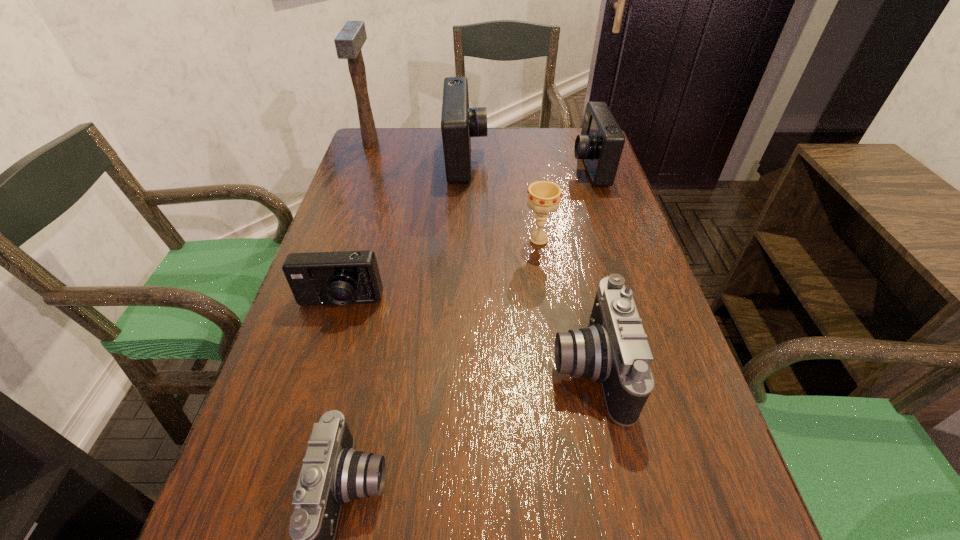
You are a GUI agent. You are given a task and a screenshot of the screen. Output one action in this format:
    pyautogui.click(x=<x>, y=<y>)
    Task: Click on the mallet situated at the far edge
    
    Given the screenshot: What is the action you would take?
    [x=351, y=38]

At what (x,y) coordinates should I click in order to perform the action: click on mallet that is at the left edge. Please return your answer as a coordinate pair (x, y). This screenshot has height=540, width=960. Looking at the image, I should click on (351, 38).

You are a GUI agent. You are given a task and a screenshot of the screen. Output one action in this format:
    pyautogui.click(x=<x>, y=<y>)
    Task: Click on the camera at the left edge
    The height and width of the screenshot is (540, 960).
    Given the screenshot: What is the action you would take?
    pyautogui.click(x=343, y=277)

Where is `object that is at the far left corner`? The width and height of the screenshot is (960, 540). object that is at the far left corner is located at coordinates (351, 38).

I want to click on object located at the far right corner, so 600,145.

What are the coordinates of `vacant space at the far edge` in the screenshot? It's located at coord(541,156).

Locate an element on the screen. This screenshot has width=960, height=540. vacant area at the left edge is located at coordinates (349, 186).

At what (x,y) coordinates should I click in order to perform the action: click on vacant position at the right edge of the desktop. Please return your answer as a coordinate pair (x, y). Looking at the image, I should click on (682, 496).

Find the location of a particular element. Image resolution: width=960 pixels, height=540 pixels. free space between the rightmost camera and the fourth farthest camera is located at coordinates (588, 268).

What are the coordinates of `free space between the rightmost object and the nearest blue camera` in the screenshot? It's located at [465, 235].